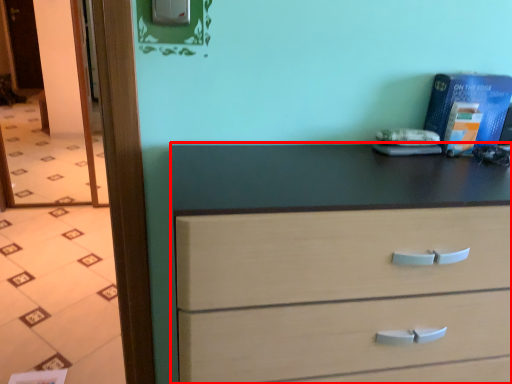
Question: From the image's perspective, what is the correct spatial positioning of chest of drawers (annotated by the red box) in reference to glass door?

Choices:
 (A) below
 (B) above

Answer: (A)